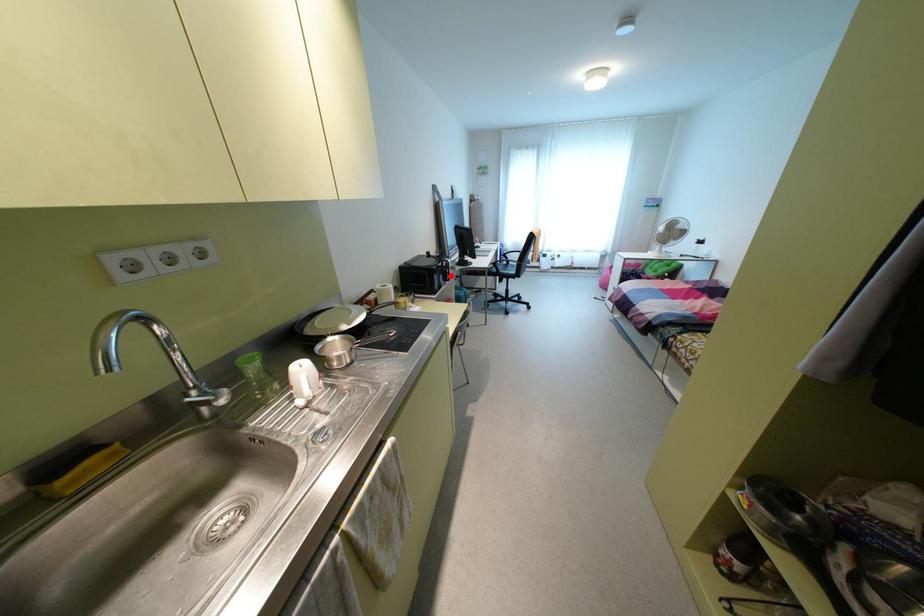
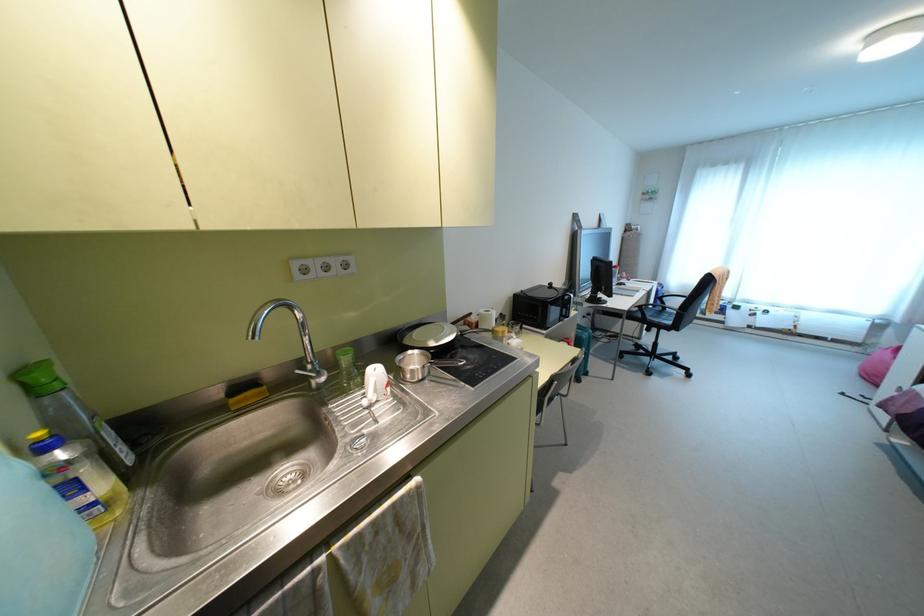
The point at the highlighted location is marked in the first image. Where is the corresponding point in the second image?

(573, 313)